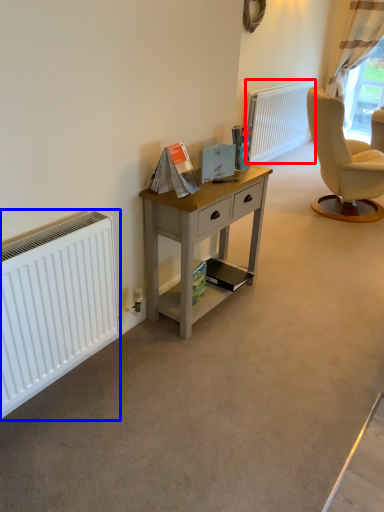
Question: Among these objects, which one is nearest to the camera, radiator (highlighted by a red box) or radiator (highlighted by a blue box)?

Choices:
 (A) radiator
 (B) radiator

Answer: (B)